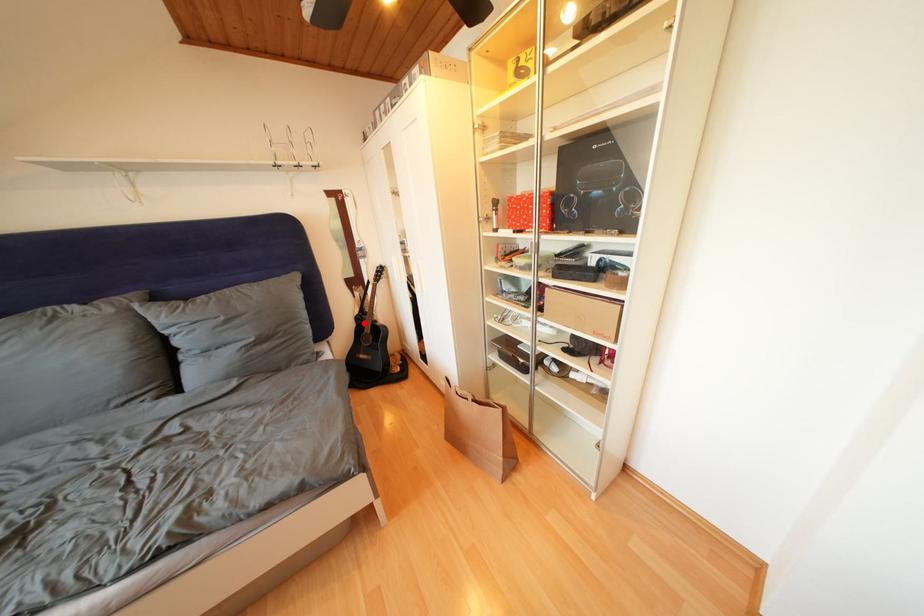
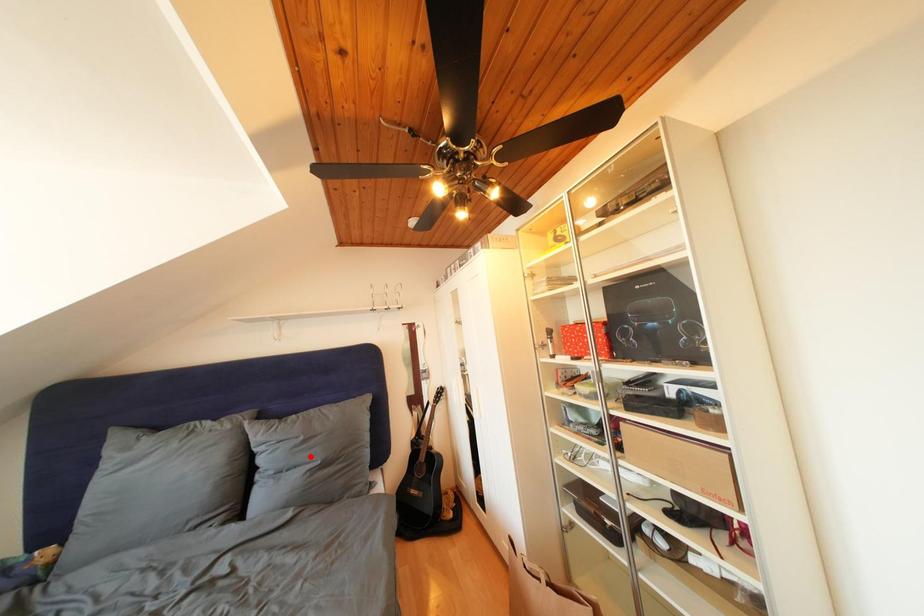
I am providing you with two images of the same scene from different viewpoints. A red point is marked on the first image and another point is marked on the second image. Does the point marked in image1 correspond to the same location as the one in image2?

No